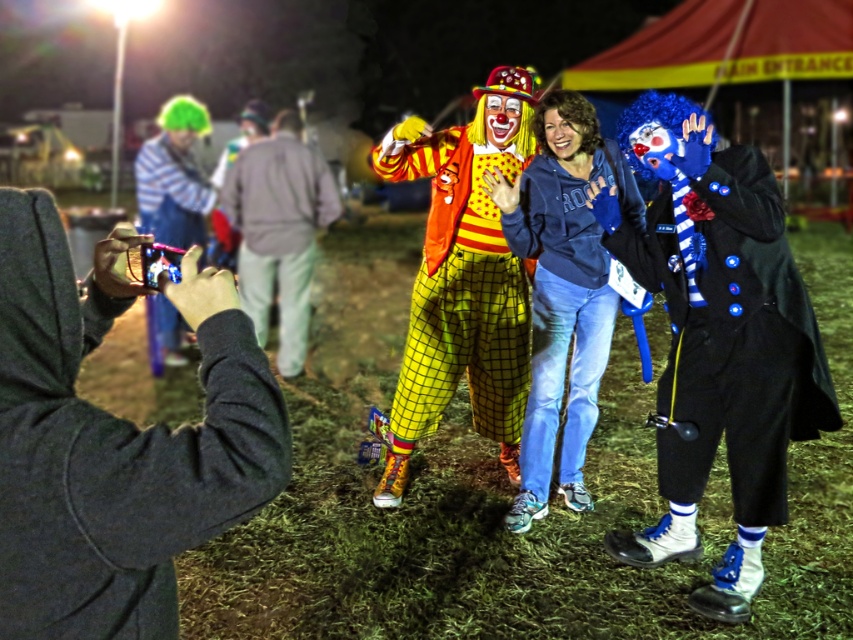
Question: Which of the following is the farthest from the observer?

Choices:
 (A) (631, 157)
 (B) (643, 276)

Answer: (B)

Question: Which point is closer to the camera?

Choices:
 (A) matte black camera at lower left
 (B) green matte wig at upper left

Answer: (A)

Question: Which object is positioned farthest from the matte black camera at lower left?

Choices:
 (A) green plastic helmet at left
 (B) blue cotton hoodie at center
 (C) light gray sweatshirt at center
 (D) matte clown face at center

Answer: (A)

Question: Is velvet blue coat at center positioned at the back of matte clown face at center?

Choices:
 (A) yes
 (B) no

Answer: (B)

Question: Does matte blue mask at center have a larger size compared to matte blue scarf at center?

Choices:
 (A) no
 (B) yes

Answer: (B)

Question: Can you confirm if velvet blue coat at center is positioned above blue cotton hoodie at center?

Choices:
 (A) no
 (B) yes

Answer: (A)